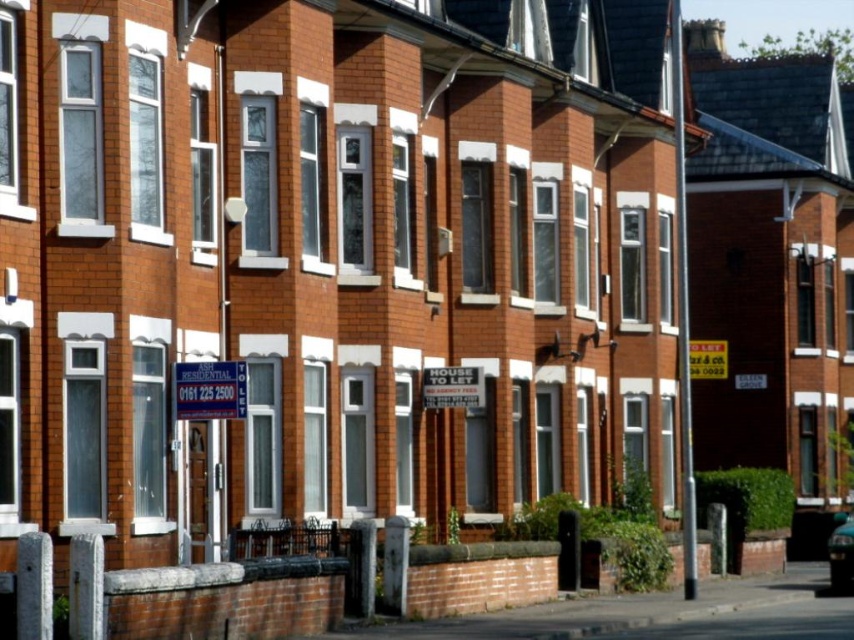
Question: Does blue plastic sign at center appear on the right side of metallic blue car at lower right?

Choices:
 (A) yes
 (B) no

Answer: (B)

Question: Which object is closer to the camera taking this photo?

Choices:
 (A) blue plastic sign at center
 (B) metallic blue car at lower right

Answer: (A)

Question: Is blue plastic sign at center thinner than metallic blue car at lower right?

Choices:
 (A) no
 (B) yes

Answer: (B)

Question: Which point appears closest to the camera in this image?

Choices:
 (A) (829, 536)
 (B) (237, 394)

Answer: (B)

Question: Does blue plastic sign at center have a larger size compared to metallic blue car at lower right?

Choices:
 (A) yes
 (B) no

Answer: (B)